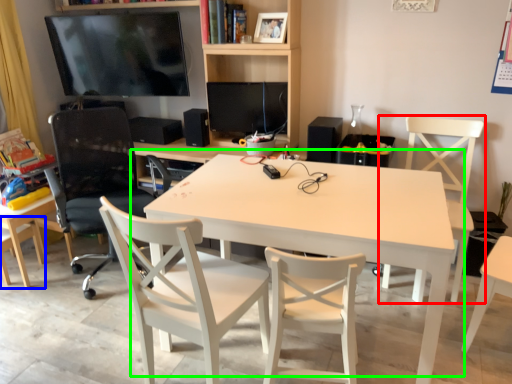
Question: Considering the real-world distances, which object is farthest from chair (highlighted by a red box)? chair (highlighted by a blue box) or table (highlighted by a green box)?

Choices:
 (A) chair
 (B) table

Answer: (A)